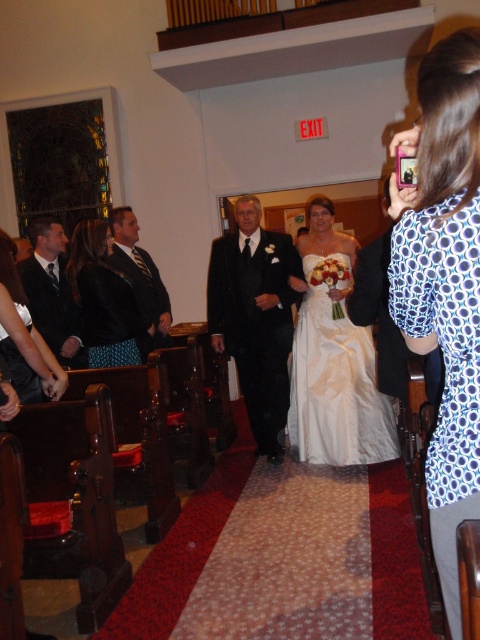
Who is more forward, (x=350, y=260) or (x=212, y=285)?

Point (x=350, y=260) is more forward.

Does white satin dress at center have a greater width compared to shiny black suit at center?

Yes.

Which is in front, point (296, 388) or point (243, 388)?

Positioned in front is point (296, 388).

Where is `white satin dress at center`? The image size is (480, 640). white satin dress at center is located at coordinates (334, 356).

Measure the distance between black leather jacket at center and shiny black suit at left.

black leather jacket at center is 21.43 inches from shiny black suit at left.

Who is more distant from viewer, (91, 264) or (73, 301)?

The point (73, 301) is more distant.

Which is in front, point (112, 365) or point (51, 225)?

Point (112, 365)

At what (x,y) coordinates should I click in order to perform the action: click on black leather jacket at center. Please return your answer as a coordinate pair (x, y). Image resolution: width=480 pixels, height=640 pixels. Looking at the image, I should click on (105, 300).

Is blue dotted blouse at right to the right of white satin dress at center from the viewer's perspective?

No, blue dotted blouse at right is not to the right of white satin dress at center.

Between blue dotted blouse at right and white satin dress at center, which one has less height?

blue dotted blouse at right

Between point (430, 221) and point (337, 362), which one is positioned in front?

Positioned in front is point (430, 221).

This screenshot has height=640, width=480. I want to click on blue dotted blouse at right, so pos(444,284).